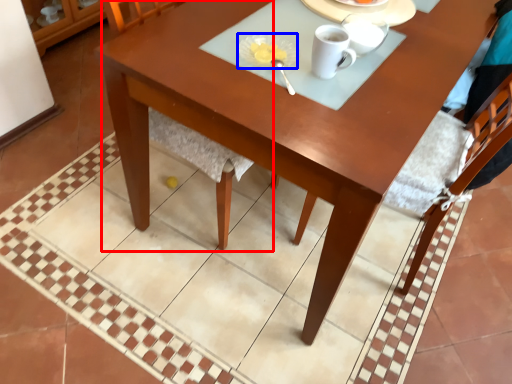
Question: Which object is closer to the camera taking this photo, chair (highlighted by a red box) or tableware (highlighted by a blue box)?

Choices:
 (A) chair
 (B) tableware

Answer: (A)